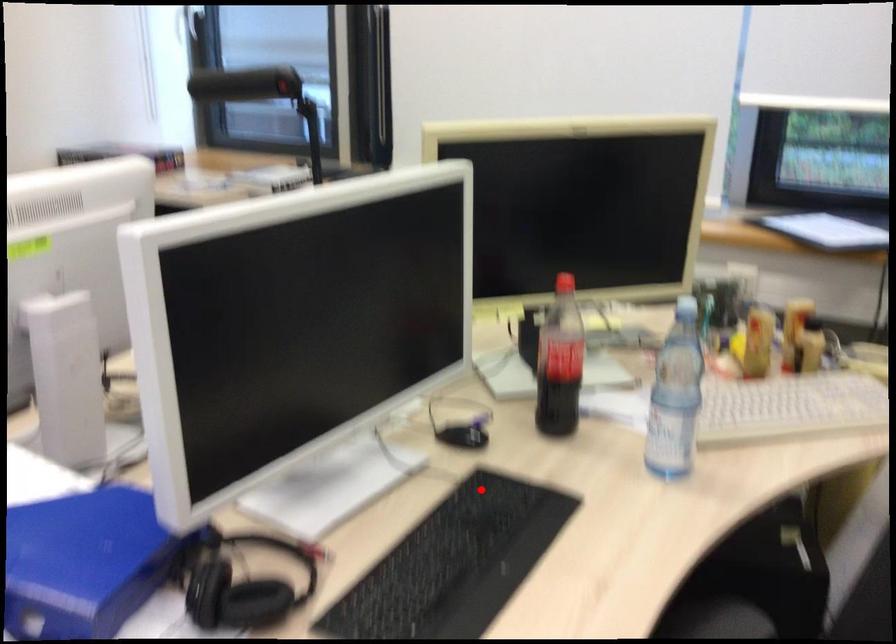
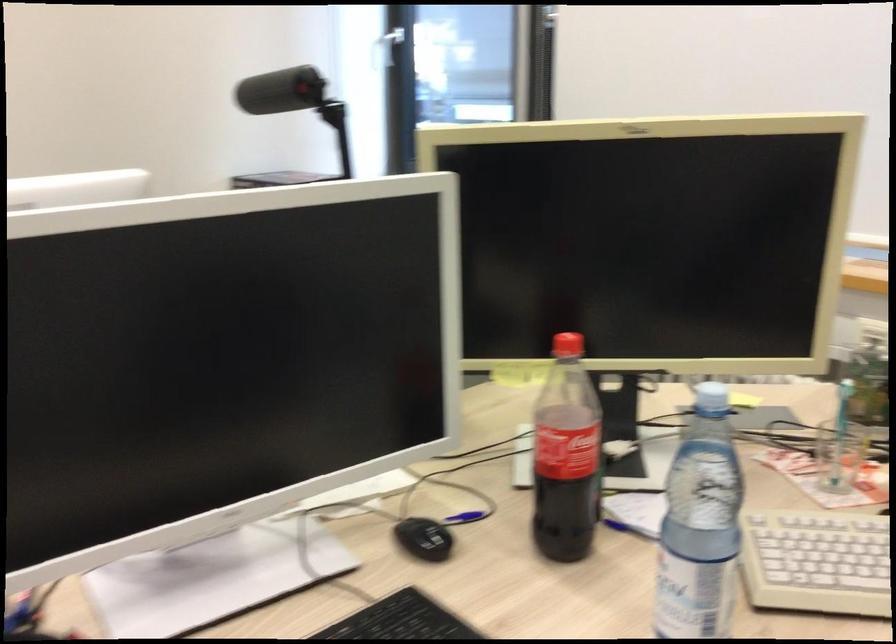
The point at the highlighted location is marked in the first image. Where is the corresponding point in the second image?

(401, 620)